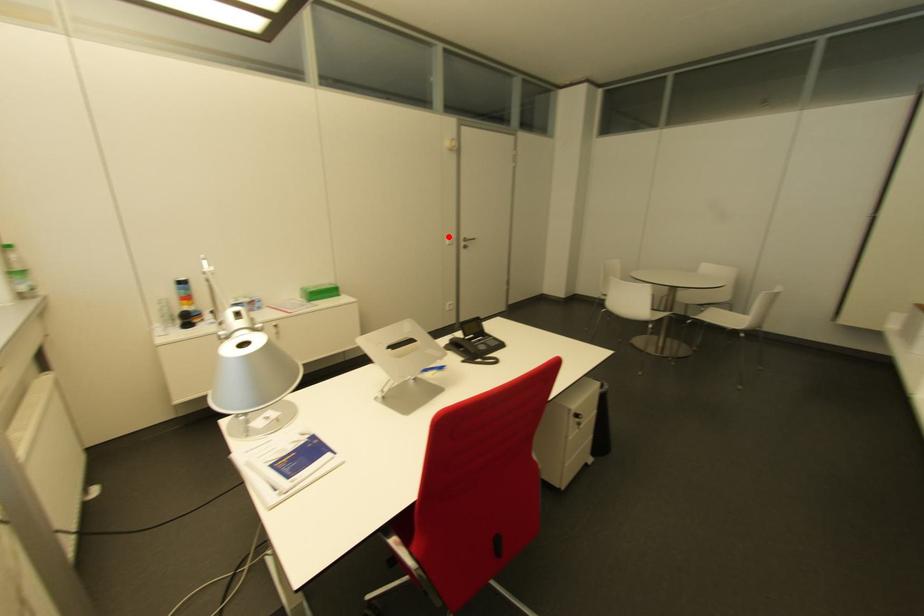
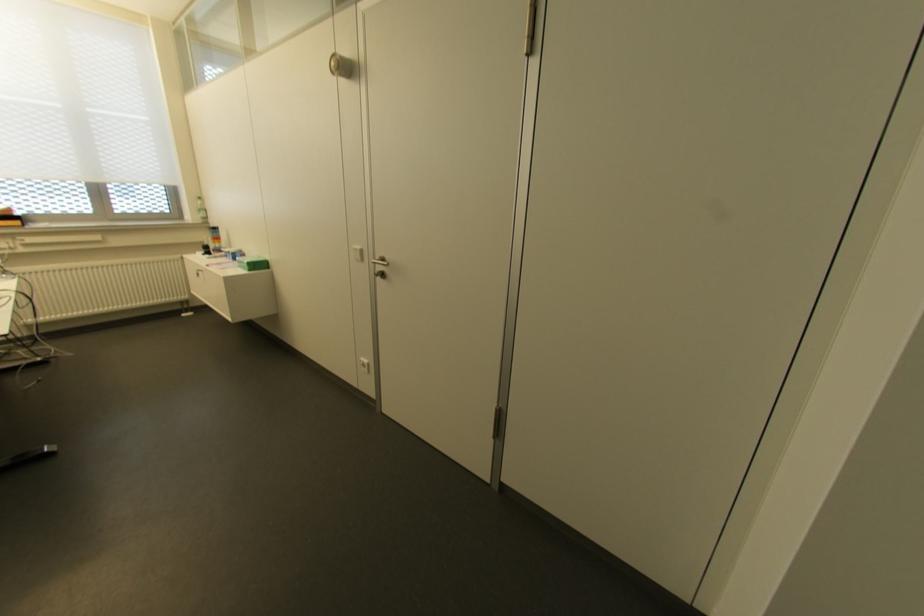
In the second image, find the point that corresponds to the highlighted location in the first image.

(358, 246)